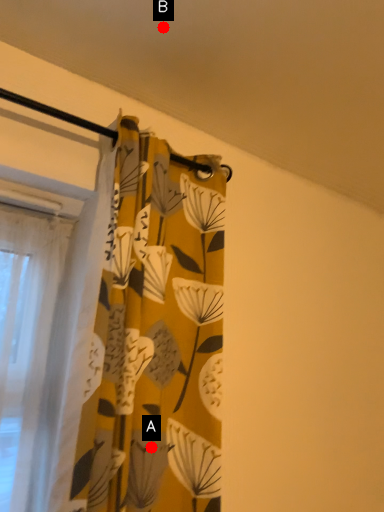
Question: Two points are circled on the image, labeled by A and B beside each circle. Which point appears closest to the camera in this image?

Choices:
 (A) A is closer
 (B) B is closer

Answer: (A)